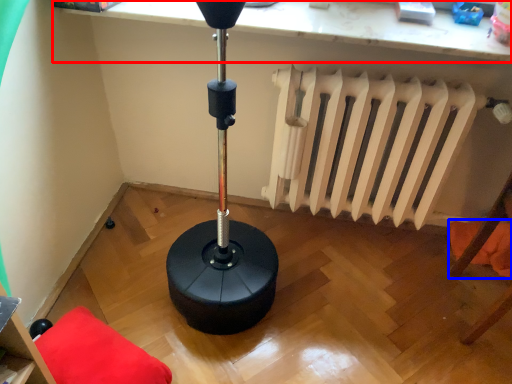
Question: Which object is further to the camera taking this photo, computer (highlighted by a red box) or pillow (highlighted by a blue box)?

Choices:
 (A) computer
 (B) pillow

Answer: (B)